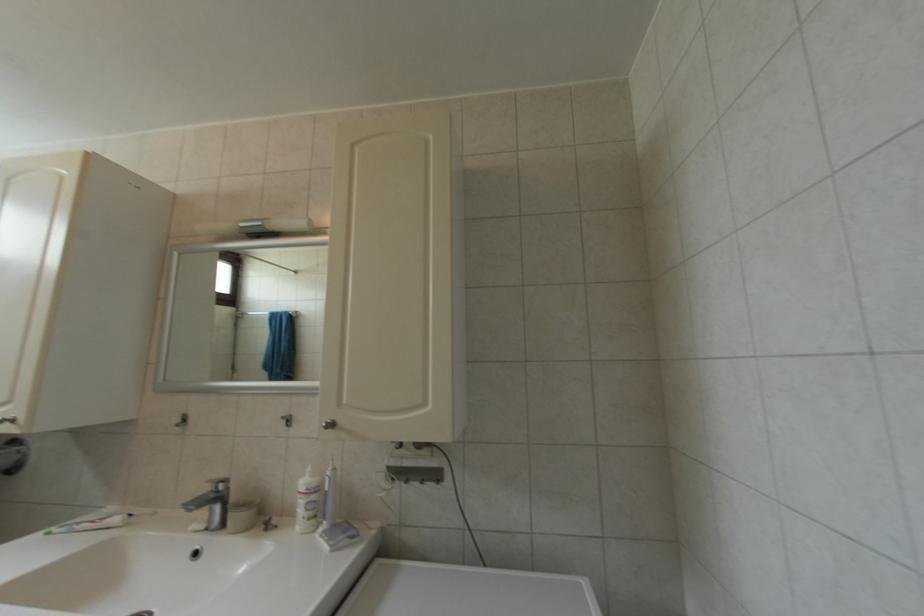
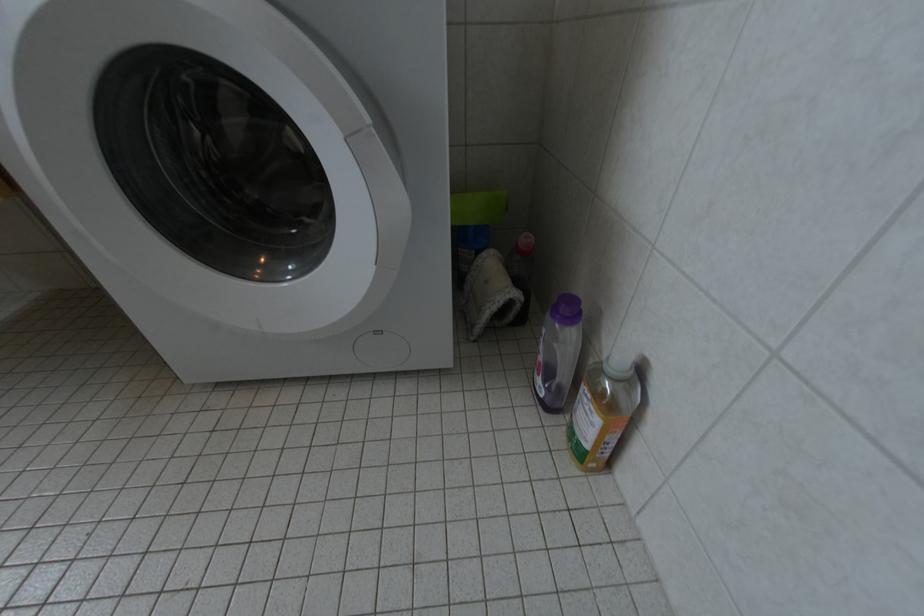
Question: Based on the continuous images, in which direction is the camera rotating? Reply with the corresponding letter.

Choices:
 (A) Left
 (B) Right
 (C) Up
 (D) Down

Answer: (D)